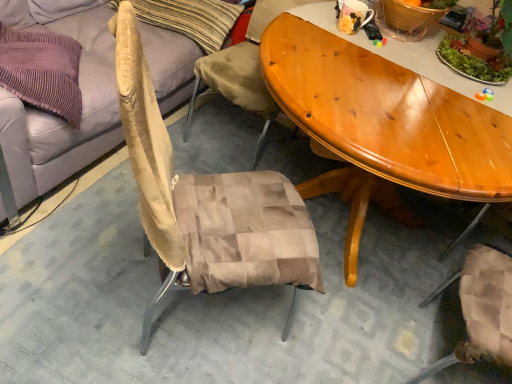
Question: Is beige fabric pillow at upper left aimed at beige fabric couch at upper left?

Choices:
 (A) no
 (B) yes

Answer: (B)

Question: Is beige fabric pillow at upper left turned away from beige fabric couch at upper left?

Choices:
 (A) yes
 (B) no

Answer: (A)

Question: Does beige fabric pillow at upper left have a smaller size compared to beige fabric couch at upper left?

Choices:
 (A) yes
 (B) no

Answer: (A)

Question: Is beige fabric pillow at upper left further to the viewer compared to beige fabric couch at upper left?

Choices:
 (A) yes
 (B) no

Answer: (A)

Question: Can you confirm if beige fabric pillow at upper left is positioned to the left of beige fabric couch at upper left?

Choices:
 (A) no
 (B) yes

Answer: (A)

Question: From the image's perspective, is matte ceramic mug at upper center located above or below green leafy plant at upper right?

Choices:
 (A) below
 (B) above

Answer: (B)

Question: Considering the positions of matte ceramic mug at upper center and green leafy plant at upper right in the image, is matte ceramic mug at upper center wider or thinner than green leafy plant at upper right?

Choices:
 (A) wide
 (B) thin

Answer: (B)

Question: Considering the positions of matte ceramic mug at upper center and green leafy plant at upper right in the image, is matte ceramic mug at upper center taller or shorter than green leafy plant at upper right?

Choices:
 (A) short
 (B) tall

Answer: (A)

Question: Does point (351, 29) appear closer or farther from the camera than point (450, 39)?

Choices:
 (A) farther
 (B) closer

Answer: (A)

Question: In terms of size, does matte ceramic mug at upper center appear bigger or smaller than beige fabric pillow at upper left?

Choices:
 (A) small
 (B) big

Answer: (A)

Question: Would you say matte ceramic mug at upper center is to the left or to the right of beige fabric pillow at upper left in the picture?

Choices:
 (A) right
 (B) left

Answer: (A)

Question: Is matte ceramic mug at upper center inside or outside of beige fabric pillow at upper left?

Choices:
 (A) outside
 (B) inside

Answer: (A)

Question: Does point (350, 4) appear closer or farther from the camera than point (138, 13)?

Choices:
 (A) farther
 (B) closer

Answer: (B)

Question: Is beige fabric couch at upper left taller or shorter than matte ceramic mug at upper center?

Choices:
 (A) short
 (B) tall

Answer: (B)

Question: In terms of size, does beige fabric couch at upper left appear bigger or smaller than matte ceramic mug at upper center?

Choices:
 (A) small
 (B) big

Answer: (B)